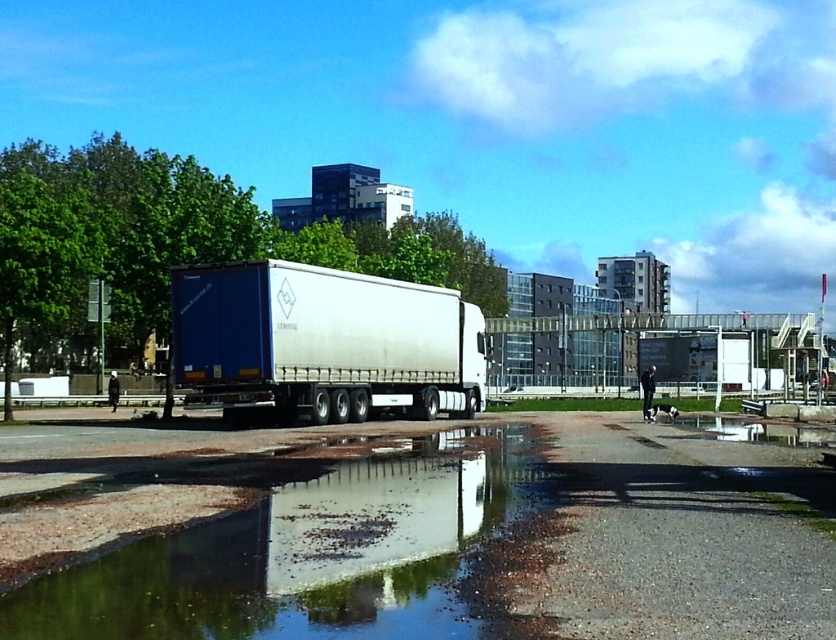
You are a delivery driver who needs to park your truck in a spot that can accommodate its size. You see the clear water at lower center and the matte white trailer truck at center. Which object indicates the minimum space required for parking?

The matte white trailer truck at center indicates the minimum space required for parking since it is larger than the clear water at lower center.

You are a delivery driver who needs to park your truck without blocking the road. The road is represented by the clear water at lower center. Can the matte white trailer truck at center fit entirely on the road without overhanging?

The clear water at lower center has a lesser height compared to matte white trailer truck at center, meaning the truck is taller than the road area. Therefore, the matte white trailer truck at center cannot fit entirely on the road without overhanging.

You are a delivery driver who needs to park your truck in the parking lot. You see the clear water at lower center and the matte white trailer truck at center. Which object is wider, and how does this affect your parking space choice?

The matte white trailer truck at center is wider than the clear water at lower center. Since the truck is wider, you should choose a parking space that can accommodate its width to ensure safe parking without overlapping other vehicles or obstacles.